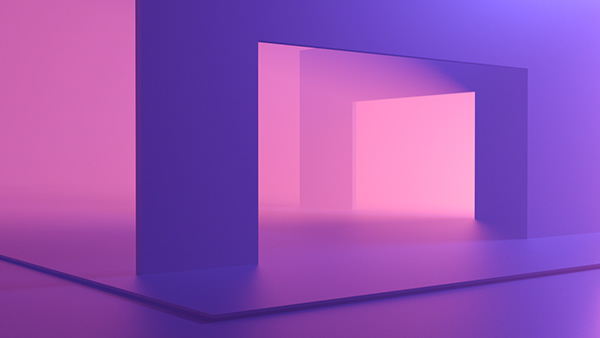
Image resolution: width=600 pixels, height=338 pixels. I want to click on dark shadow in corner, so click(485, 98).